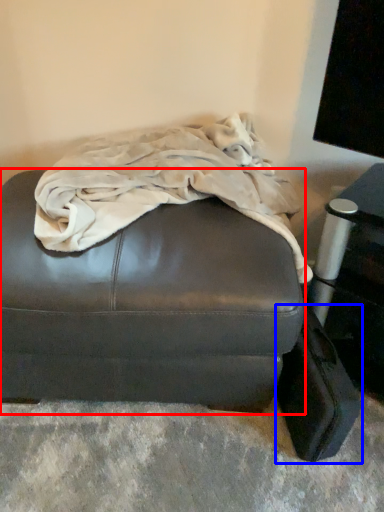
Question: Among these objects, which one is farthest to the camera, furniture (highlighted by a red box) or luggage (highlighted by a blue box)?

Choices:
 (A) furniture
 (B) luggage

Answer: (B)